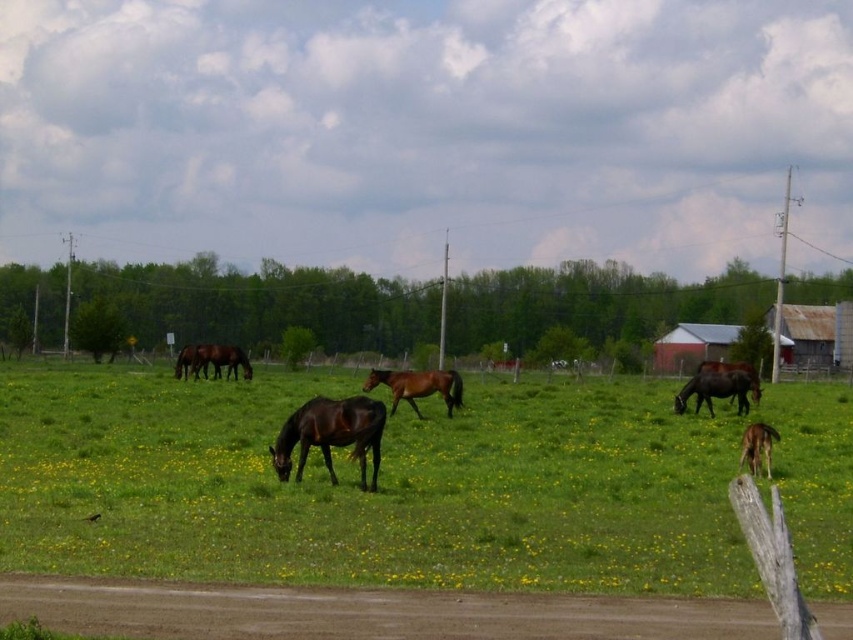
Question: Is the position of brown glossy horse at center more distant than that of brown glossy horse at lower right?

Choices:
 (A) yes
 (B) no

Answer: (A)

Question: Is brown glossy horse at center bigger than brown glossy horse at lower right?

Choices:
 (A) no
 (B) yes

Answer: (B)

Question: Considering the relative positions of glossy brown horse at center and brown glossy horse at lower right in the image provided, where is glossy brown horse at center located with respect to brown glossy horse at lower right?

Choices:
 (A) below
 (B) above

Answer: (B)

Question: Which object is closer to the camera taking this photo?

Choices:
 (A) brown glossy horse at lower right
 (B) shiny dark brown horse at right

Answer: (A)

Question: Which object is farther from the camera taking this photo?

Choices:
 (A) brown glossy horse at center
 (B) brown glossy horse at left

Answer: (B)

Question: Which of the following is the closest to the observer?

Choices:
 (A) (194, 374)
 (B) (759, 445)
 (C) (229, 400)

Answer: (B)